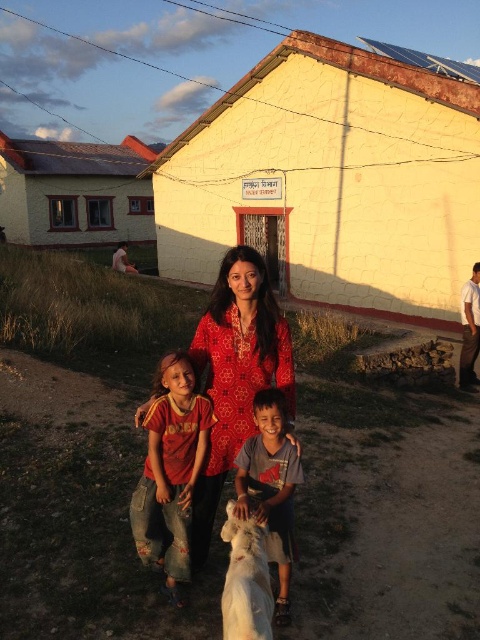
Question: Which point appears closest to the camera in this image?

Choices:
 (A) (269, 288)
 (B) (252, 538)

Answer: (B)

Question: Is matte yellow house at upper left below matte red shirt at center?

Choices:
 (A) no
 (B) yes

Answer: (A)

Question: Can you confirm if matte red shirt at center is bigger than white fluffy dog at center?

Choices:
 (A) no
 (B) yes

Answer: (B)

Question: Which of these objects is positioned farthest from the matte red shirt at center?

Choices:
 (A) light blue cotton shirt at center
 (B) white fluffy dog at center
 (C) yellow stucco hut at center
 (D) matte yellow house at upper left

Answer: (D)

Question: Among these points, which one is nearest to the camera?

Choices:
 (A) (228, 611)
 (B) (278, 401)

Answer: (A)

Question: Can you confirm if yellow stucco hut at center is thinner than red floral dress at center?

Choices:
 (A) no
 (B) yes

Answer: (A)